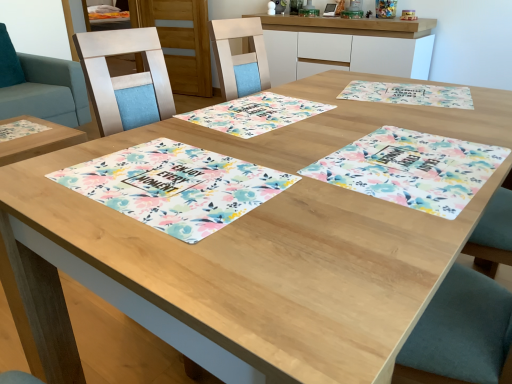
Question: In the image, is floral fabric placemat at center, the 1th place mat when ordered from left to right, on the left side or the right side of floral fabric placemat at center, which is the second place mat from right to left?

Choices:
 (A) left
 (B) right

Answer: (A)

Question: From the image's perspective, is floral fabric placemat at center, which is counted as the 4th place mat, starting from the right, located above or below floral fabric placemat at center, which is the second place mat from right to left?

Choices:
 (A) above
 (B) below

Answer: (B)

Question: Estimate the real-world distances between objects in this image. Which object is farther from the floral fabric placemat at center, which is the second place mat from right to left?

Choices:
 (A) teal fabric swivel chair at upper left
 (B) floral fabric placemat at upper right, marked as the first place mat in a right-to-left arrangement
 (C) floral fabric placemat at center, which is counted as the 4th place mat, starting from the right
 (D) floral fabric placemat at center, arranged as the 3th place mat when viewed from the right
 (E) wooden cabinet at upper center, which is the second cabinetry in front-to-back order

Answer: (E)

Question: Based on their relative distances, which object is nearer to the floral fabric placemat at center, which is the second place mat from right to left?

Choices:
 (A) wooden cabinet at upper center, acting as the first cabinetry starting from the left
 (B) teal fabric swivel chair at upper left
 (C) floral fabric placemat at center, the 1th place mat when ordered from left to right
 (D) floral fabric placemat at center, the second place mat in the left-to-right sequence
 (E) floral fabric placemat at upper right, which is the fourth place mat in left-to-right order

Answer: (C)